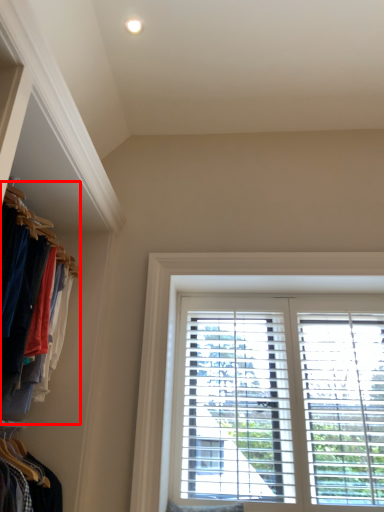
Question: From the image's perspective, what is the correct spatial relationship of closet (annotated by the red box) in relation to window?

Choices:
 (A) above
 (B) below

Answer: (A)